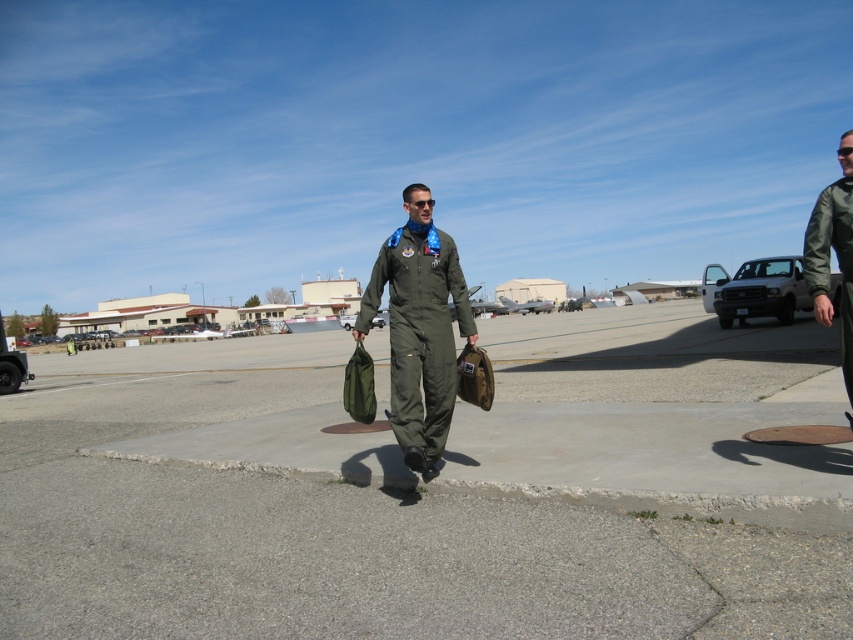
You are a photographer at the airfield. You need to capture a photo of the green fabric bag at center and the green matte jumpsuit at center. Which object should you zoom in on to ensure both are clearly visible in the frame?

The green fabric bag at center is larger in size than the green matte jumpsuit at center, so you should zoom in on the green matte jumpsuit at center to ensure both are clearly visible in the frame.

You are a photographer trying to capture both the green matte jumpsuit at center and the green matte jacket at right in a single frame. Since you want to ensure both are visible, which object should you focus on first to avoid blurring due to their size differences?

The green matte jumpsuit at center is shorter than the green matte jacket at right, so focusing on the green matte jacket at right first would be better since it is taller and might require more precise focus to capture details without blurring.

You are a photographer at the airfield and want to capture both the green fabric bag at center and the green matte jacket at right in the same frame. Which object should you focus on first to ensure both are in the frame?

The green fabric bag at center is shorter than the green matte jacket at right, so you should focus on the green matte jacket at right first to ensure both are in the frame.